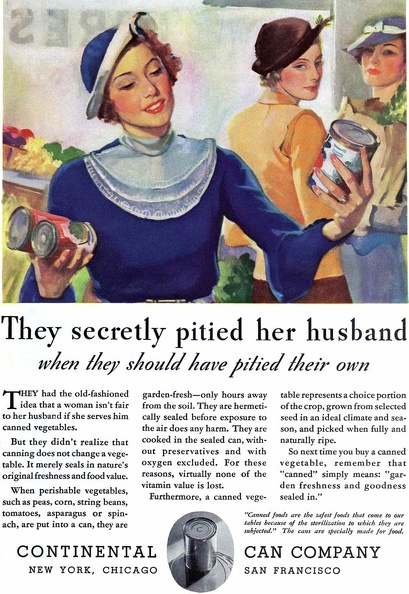
This screenshot has width=409, height=594. What are the coordinates of `window` in the screenshot? It's located at (218, 53).